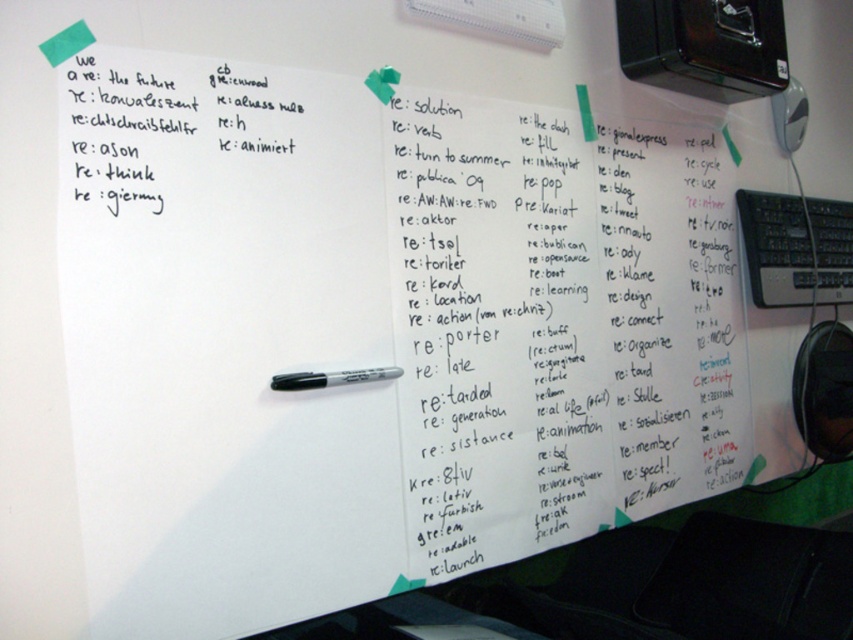
Question: Which object is the closest to the green matte sticky note at upper left?

Choices:
 (A) black marker pen at center
 (B) black plastic keyboard at right

Answer: (A)

Question: Can you confirm if black marker pen at center is bigger than green matte sticky note at upper left?

Choices:
 (A) yes
 (B) no

Answer: (A)

Question: Which object is closer to the camera taking this photo?

Choices:
 (A) black plastic keyboard at right
 (B) black marker pen at center

Answer: (B)

Question: Which point is farther to the camera?

Choices:
 (A) green matte sticky note at upper left
 (B) black plastic keyboard at right

Answer: (B)

Question: Can you confirm if black marker pen at center is positioned to the right of green matte sticky note at upper left?

Choices:
 (A) no
 (B) yes

Answer: (B)

Question: Considering the relative positions of black plastic keyboard at right and green matte sticky note at upper left in the image provided, where is black plastic keyboard at right located with respect to green matte sticky note at upper left?

Choices:
 (A) left
 (B) right

Answer: (B)